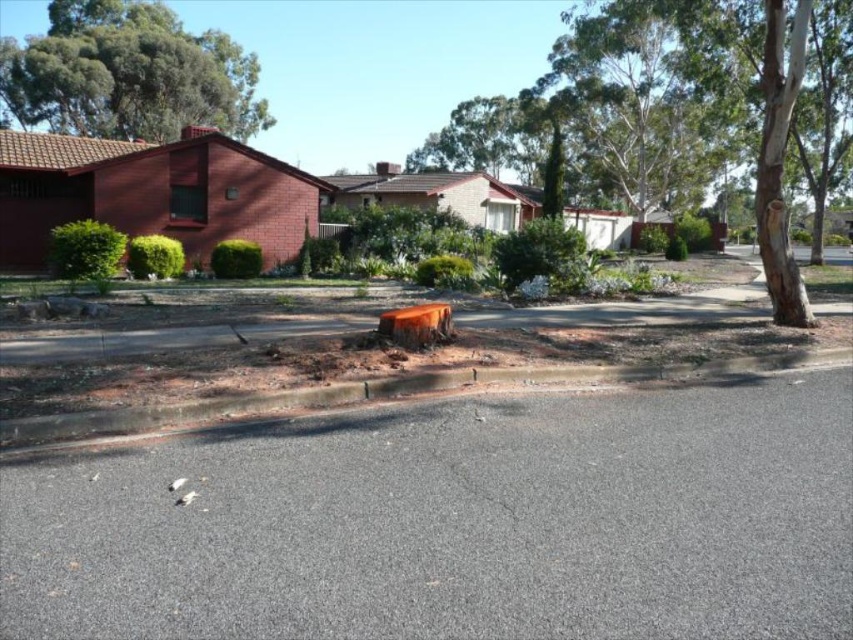
You are a gardener looking at the suburban residential area. You need to trim the branches of the smooth bark tree at center and the green leafy tree at upper left. Which tree will require you to work closer to the road?

The smooth bark tree at center is in front of the green leafy tree at upper left, so you will need to work closer to the road when trimming the smooth bark tree at center.

You are a drone operator trying to capture aerial footage of the suburban area. You have two points marked on your map, point 1 at coordinates point (428, 161) and point 2 at coordinates point (62, 28). Which point is closer to the camera to ensure better focus?

Point (62, 28) is closer to the camera than point (428, 161), so focusing on point (62, 28) would ensure better focus.